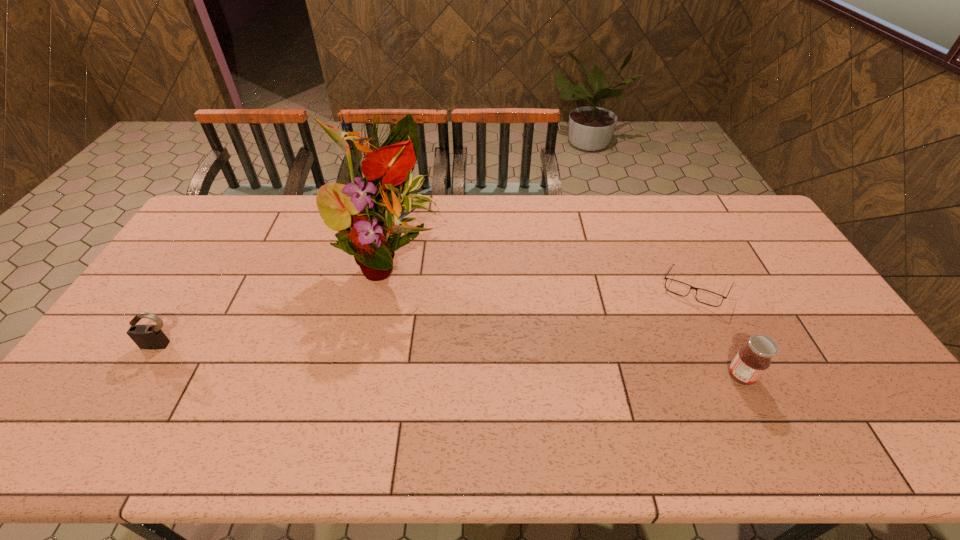
Find the location of a particular element. the leftmost object is located at coordinates (151, 337).

Where is `padlock`? Image resolution: width=960 pixels, height=540 pixels. padlock is located at coordinates (151, 337).

This screenshot has width=960, height=540. What are the coordinates of `the nearest object` in the screenshot? It's located at (750, 363).

Locate an element on the screen. Image resolution: width=960 pixels, height=540 pixels. the tallest object is located at coordinates (367, 213).

In order to click on bouquet in this screenshot , I will do `click(367, 213)`.

Where is `spectacles`? spectacles is located at coordinates (710, 298).

The height and width of the screenshot is (540, 960). What are the coordinates of `vacant space located 0.140m with the keyhole on the front of the padlock` in the screenshot? It's located at (130, 396).

Identify the location of free location located on the label side of the nearest object. (790, 376).

Image resolution: width=960 pixels, height=540 pixels. I want to click on vacant area located on the front-facing side of the bouquet, so click(390, 314).

Locate an element on the screen. Image resolution: width=960 pixels, height=540 pixels. vacant space located on the front-facing side of the bouquet is located at coordinates (389, 353).